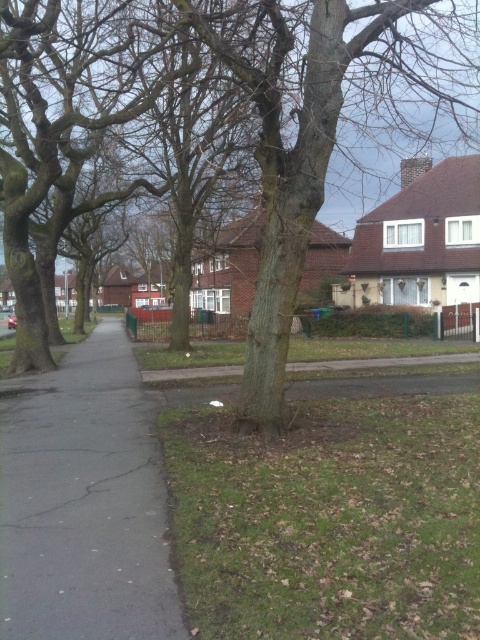
Does brown rough tree at center have a larger size compared to black asphalt pavement at left?

Yes, brown rough tree at center is bigger than black asphalt pavement at left.

Is point (252, 428) behind point (136, 595)?

Yes, it is.

You are a GUI agent. You are given a task and a screenshot of the screen. Output one action in this format:
    pyautogui.click(x=<x>, y=<y>)
    Task: Click on the brown rough tree at center
    This screenshot has width=480, height=640.
    Given the screenshot: What is the action you would take?
    pyautogui.click(x=326, y=120)